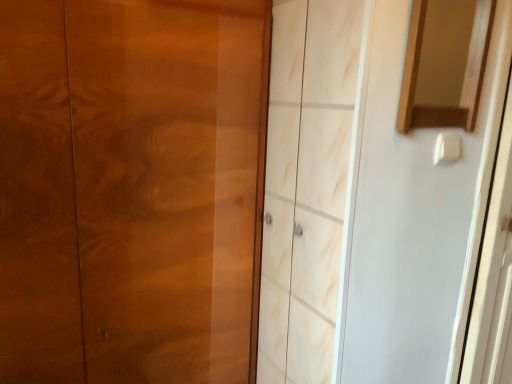
Question: From the image's perspective, does glossy wood door at left appear higher than white glossy screen door at right?

Choices:
 (A) yes
 (B) no

Answer: (A)

Question: Does glossy wood door at left appear on the right side of white glossy screen door at right?

Choices:
 (A) yes
 (B) no

Answer: (B)

Question: Is glossy wood door at left bigger than white glossy screen door at right?

Choices:
 (A) no
 (B) yes

Answer: (B)

Question: Is glossy wood door at left positioned with its back to white glossy screen door at right?

Choices:
 (A) no
 (B) yes

Answer: (A)

Question: Is glossy wood door at left taller than white glossy screen door at right?

Choices:
 (A) no
 (B) yes

Answer: (B)

Question: Is glossy wood door at left not close to white glossy screen door at right?

Choices:
 (A) no
 (B) yes

Answer: (A)

Question: Considering the relative sizes of white glossy screen door at right and wooden mirror at upper right in the image provided, is white glossy screen door at right bigger than wooden mirror at upper right?

Choices:
 (A) no
 (B) yes

Answer: (B)

Question: From a real-world perspective, is white glossy screen door at right physically below wooden mirror at upper right?

Choices:
 (A) no
 (B) yes

Answer: (B)

Question: Can you confirm if white glossy screen door at right is positioned to the right of wooden mirror at upper right?

Choices:
 (A) no
 (B) yes

Answer: (B)

Question: From the image's perspective, is white glossy screen door at right over wooden mirror at upper right?

Choices:
 (A) yes
 (B) no

Answer: (B)

Question: Does white glossy screen door at right touch wooden mirror at upper right?

Choices:
 (A) yes
 (B) no

Answer: (B)

Question: Can you confirm if white glossy screen door at right is positioned to the left of wooden mirror at upper right?

Choices:
 (A) no
 (B) yes

Answer: (A)

Question: Is glossy wood door at left completely or partially outside of wooden mirror at upper right?

Choices:
 (A) no
 (B) yes

Answer: (B)